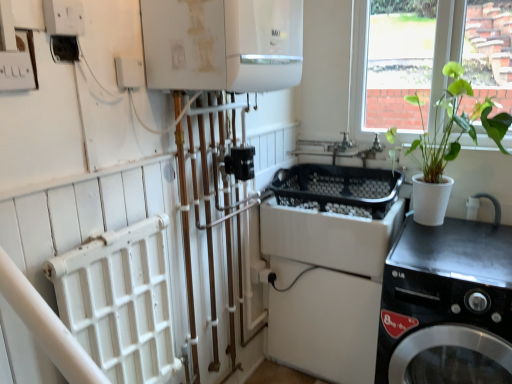
Question: From a real-world perspective, is white glossy boiler at upper center below transparent glass window at upper right?

Choices:
 (A) yes
 (B) no

Answer: (B)

Question: Would you consider white glossy boiler at upper center to be distant from transparent glass window at upper right?

Choices:
 (A) yes
 (B) no

Answer: (B)

Question: Would you say white glossy boiler at upper center contains transparent glass window at upper right?

Choices:
 (A) no
 (B) yes

Answer: (A)

Question: Does white glossy boiler at upper center have a lesser width compared to transparent glass window at upper right?

Choices:
 (A) no
 (B) yes

Answer: (A)

Question: Considering the relative sizes of white glossy boiler at upper center and transparent glass window at upper right in the image provided, is white glossy boiler at upper center smaller than transparent glass window at upper right?

Choices:
 (A) no
 (B) yes

Answer: (A)

Question: Based on their positions, is white plastic electric outlet at upper left located to the left or right of green leafy plant in white pot at right?

Choices:
 (A) left
 (B) right

Answer: (A)

Question: Relative to green leafy plant in white pot at right, is white plastic electric outlet at upper left in front or behind?

Choices:
 (A) behind
 (B) front

Answer: (B)

Question: From the image's perspective, is white plastic electric outlet at upper left positioned above or below green leafy plant in white pot at right?

Choices:
 (A) above
 (B) below

Answer: (A)

Question: Is white plastic electric outlet at upper left taller or shorter than green leafy plant in white pot at right?

Choices:
 (A) tall
 (B) short

Answer: (B)

Question: In the image, is transparent glass window at upper right on the left side or the right side of white glossy boiler at upper center?

Choices:
 (A) right
 (B) left

Answer: (A)

Question: Considering the positions of transparent glass window at upper right and white glossy boiler at upper center in the image, is transparent glass window at upper right wider or thinner than white glossy boiler at upper center?

Choices:
 (A) thin
 (B) wide

Answer: (A)

Question: From a real-world perspective, is transparent glass window at upper right positioned above or below white glossy boiler at upper center?

Choices:
 (A) above
 (B) below

Answer: (B)

Question: From the image's perspective, relative to white glossy boiler at upper center, is transparent glass window at upper right above or below?

Choices:
 (A) above
 (B) below

Answer: (A)

Question: In terms of width, does black glossy washing machine at lower right look wider or thinner when compared to transparent glass window at upper right?

Choices:
 (A) thin
 (B) wide

Answer: (B)

Question: Looking at the image, does black glossy washing machine at lower right seem bigger or smaller compared to transparent glass window at upper right?

Choices:
 (A) big
 (B) small

Answer: (A)